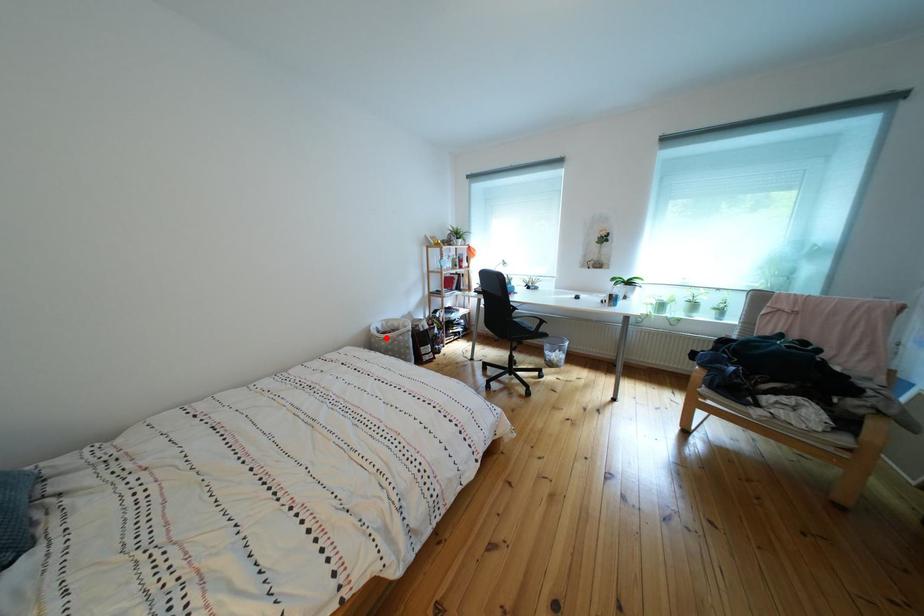
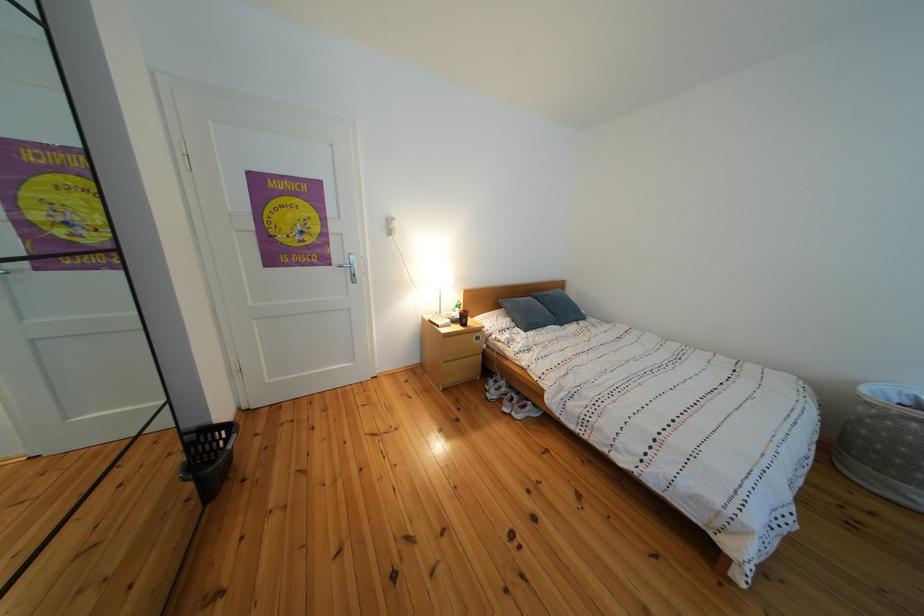
Question: I am providing you with two images of the same scene from different viewpoints. A red point is marked on the first image. At the location where the point appears in image 1, is it still visible in image 2?

Choices:
 (A) Yes
 (B) No

Answer: (A)